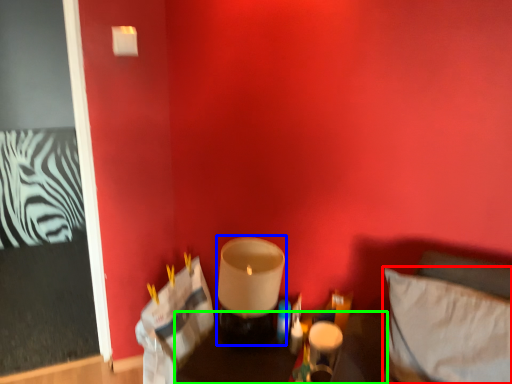
Question: Which object is the farthest from pillow (highlighted by a red box)? Choose among these: candle holder (highlighted by a blue box) or furniture (highlighted by a green box).

Choices:
 (A) candle holder
 (B) furniture

Answer: (B)